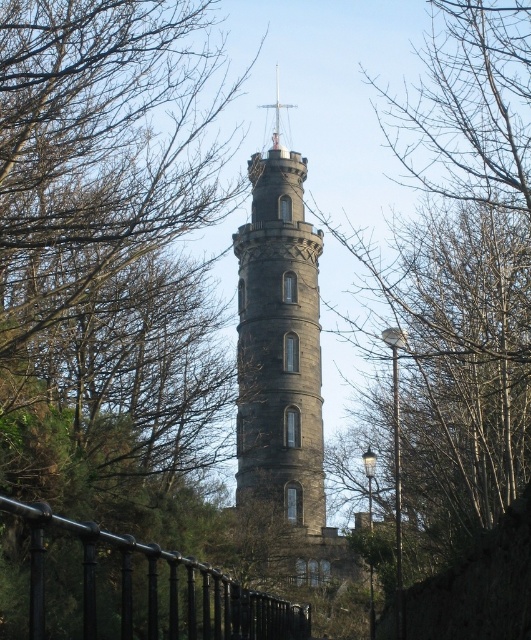
Question: Can you confirm if dark stone tower at center is wider than black metal fence at lower left?

Choices:
 (A) yes
 (B) no

Answer: (B)

Question: Can you confirm if dark stone tower at center is bigger than black metal fence at lower left?

Choices:
 (A) no
 (B) yes

Answer: (A)

Question: Where is dark stone tower at center located in relation to black metal fence at lower left in the image?

Choices:
 (A) right
 (B) left

Answer: (A)

Question: Which point appears closest to the camera in this image?

Choices:
 (A) (212, 586)
 (B) (309, 356)

Answer: (A)